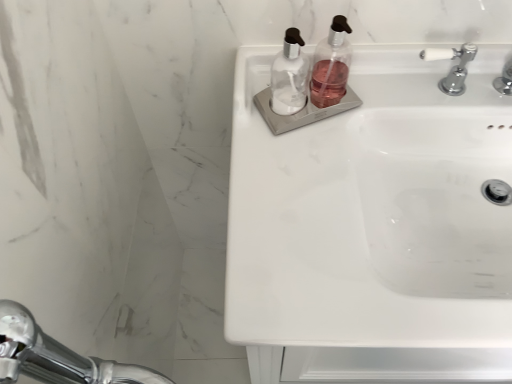
Identify the location of vacant area that lies between transparent plastic soap dispenser at upper center, marked as the 1th soap dispenser in a right-to-left arrangement, and white ceramic tap at upper right. This screenshot has height=384, width=512. (379, 97).